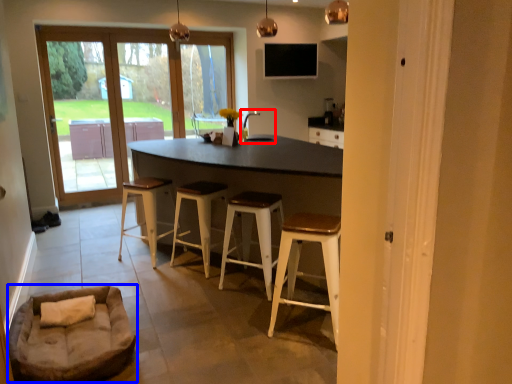
Question: Which point is further to the camera, sink (highlighted by a red box) or couch (highlighted by a blue box)?

Choices:
 (A) sink
 (B) couch

Answer: (A)